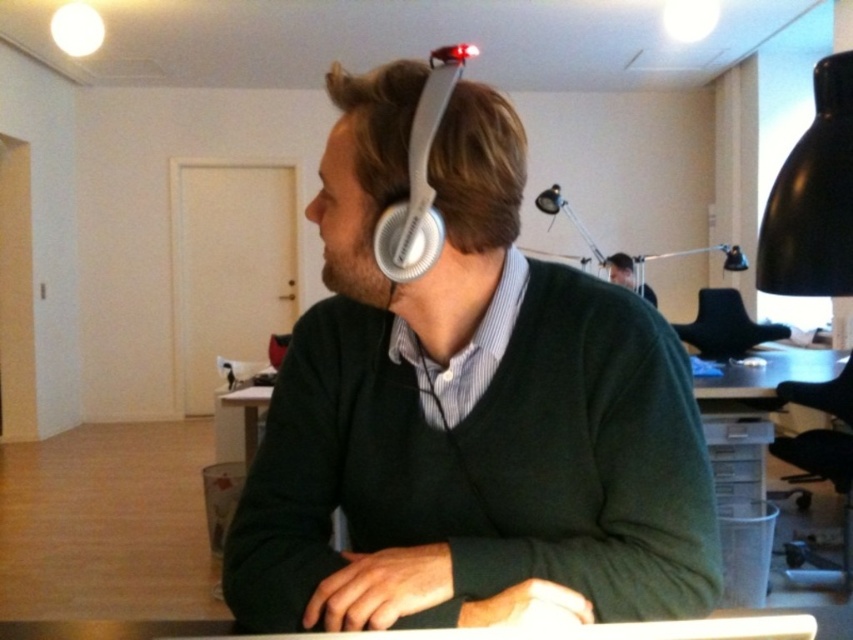
Can you confirm if matte white headphones at center is taller than black leather chair at center?

Yes, matte white headphones at center is taller than black leather chair at center.

Between point (277, 381) and point (724, 316), which one is positioned behind?

Positioned behind is point (724, 316).

Locate an element on the screen. The image size is (853, 640). matte white headphones at center is located at coordinates (466, 412).

Is white matte earphone at upper center closer to the viewer compared to black leather chair at center?

Yes, it is in front of black leather chair at center.

Is point (375, 227) more distant than point (711, 342)?

No, (375, 227) is closer to viewer.

Locate an element on the screen. Image resolution: width=853 pixels, height=640 pixels. white matte earphone at upper center is located at coordinates (407, 240).

The height and width of the screenshot is (640, 853). Find the location of `white matte earphone at upper center`. white matte earphone at upper center is located at coordinates (407, 240).

Is point (397, 259) more distant than point (656, 304)?

No, it is not.

Is white matte earphone at upper center shorter than matte green sweater at upper center?

Yes, white matte earphone at upper center is shorter than matte green sweater at upper center.

Locate an element on the screen. The width and height of the screenshot is (853, 640). white matte earphone at upper center is located at coordinates (407, 240).